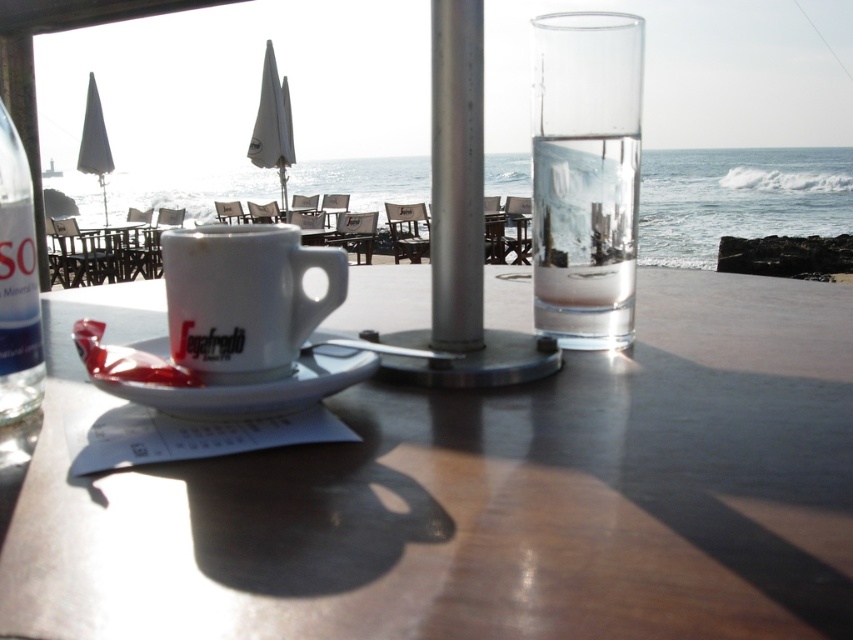
Which is above, matte white table at center or clear glass bottle at left?

Positioned higher is clear glass bottle at left.

Between matte white table at center and clear glass bottle at left, which one appears on the left side from the viewer's perspective?

clear glass bottle at left is more to the left.

What are the coordinates of `matte white table at center` in the screenshot? It's located at (480, 493).

Does matte white table at center have a lesser height compared to white glossy mug at center?

Incorrect, matte white table at center's height does not fall short of white glossy mug at center's.

Which is below, matte white table at center or white glossy mug at center?

matte white table at center is below.

The image size is (853, 640). Identify the location of matte white table at center. (480, 493).

Who is positioned more to the right, clear glass water at upper center or white glossy mug at center?

clear glass water at upper center

Is point (691, 166) positioned behind point (264, 236)?

That is True.

Between point (77, 180) and point (325, 275), which one is positioned in front?

Point (325, 275)

In order to click on clear glass water at upper center in this screenshot , I will do pos(738,198).